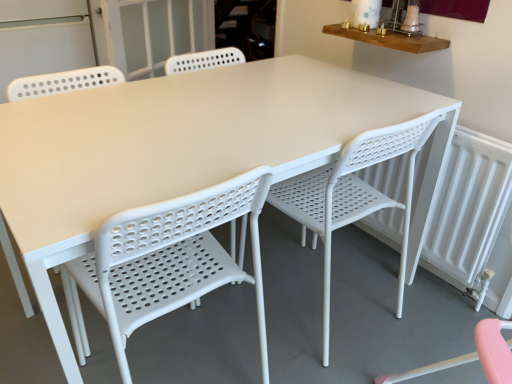
This screenshot has width=512, height=384. In order to click on free space below white perforated plastic chair at center, arranged as the first chair when viewed from the left (from a real-world perspective) in this screenshot , I will do `click(180, 357)`.